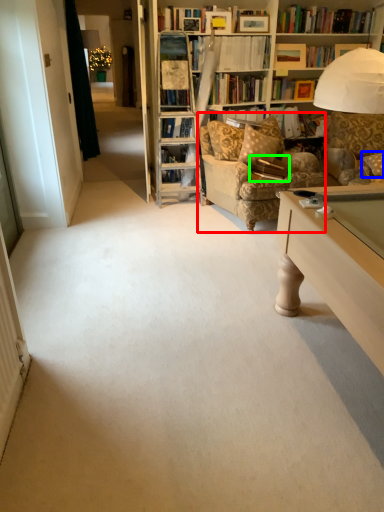
Question: Based on their relative distances, which object is farther from chair (highlighted by a red box)? Choose from pillow (highlighted by a blue box) and book (highlighted by a green box).

Choices:
 (A) pillow
 (B) book

Answer: (A)